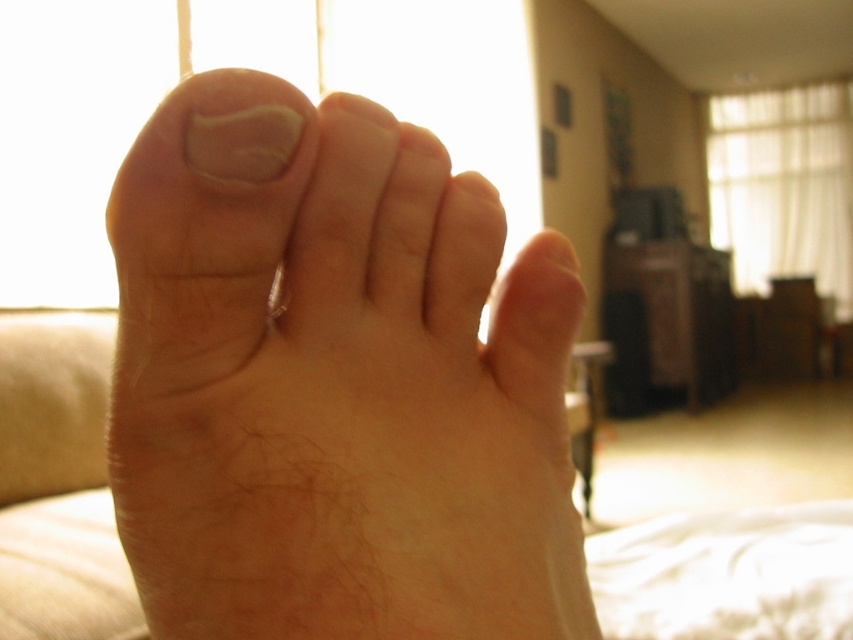
Between point (502, 384) and point (670, 548), which one is positioned in front?

Point (502, 384) is in front.

Is pale skin foot at center wider than white soft bed at lower left?

In fact, pale skin foot at center might be narrower than white soft bed at lower left.

Which is in front, point (535, 516) or point (839, 513)?

Point (535, 516) is in front.

You are a GUI agent. You are given a task and a screenshot of the screen. Output one action in this format:
    pyautogui.click(x=<x>, y=<y>)
    Task: Click on the pale skin foot at center
    This screenshot has height=640, width=853.
    Given the screenshot: What is the action you would take?
    pyautogui.click(x=334, y=381)